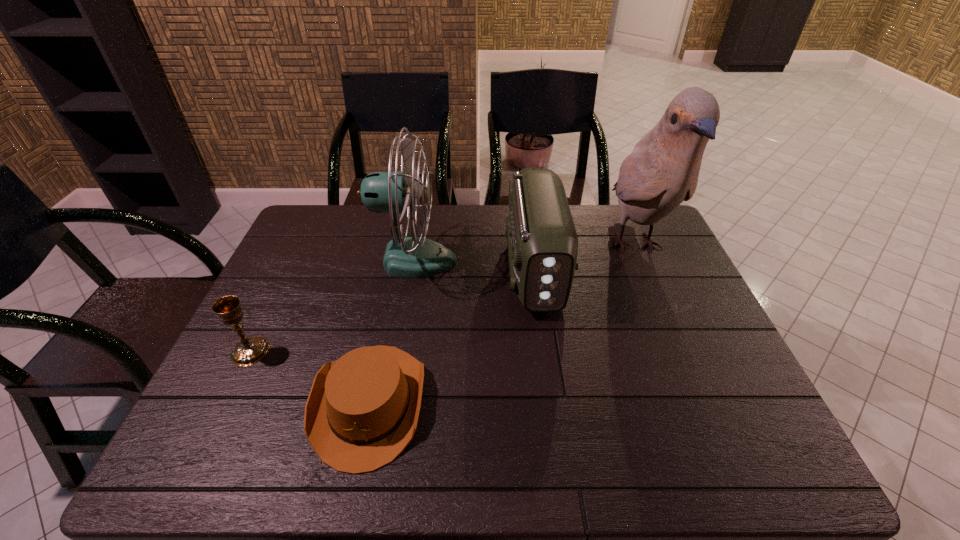
In the image, there is a desktop. Find the location of `free space at the near edge`. free space at the near edge is located at coordinates (607, 446).

Where is `vacant point at the left edge`? vacant point at the left edge is located at coordinates (295, 326).

Identify the location of vacant area at the right edge of the desktop. The width and height of the screenshot is (960, 540). (678, 252).

Identify the location of vacant space at the far left corner of the desktop. (323, 211).

Find the location of a particular element. This screenshot has width=960, height=540. vacant region at the near left corner of the desktop is located at coordinates (190, 445).

This screenshot has height=540, width=960. I want to click on vacant area between the fourth tallest object and the tallest object, so click(x=443, y=299).

This screenshot has height=540, width=960. I want to click on vacant region between the fourth tallest object and the third tallest object, so click(x=393, y=310).

At what (x,y) coordinates should I click in order to perform the action: click on vacant area between the second tallest object and the cowboy hat. Please return your answer as a coordinate pair (x, y). Image resolution: width=960 pixels, height=540 pixels. Looking at the image, I should click on (392, 332).

The height and width of the screenshot is (540, 960). Identify the location of empty space that is in between the radio_receiver and the parakeet. (585, 258).

This screenshot has width=960, height=540. Find the location of `vacant area between the radio_receiver and the cowboy hat`. vacant area between the radio_receiver and the cowboy hat is located at coordinates (452, 336).